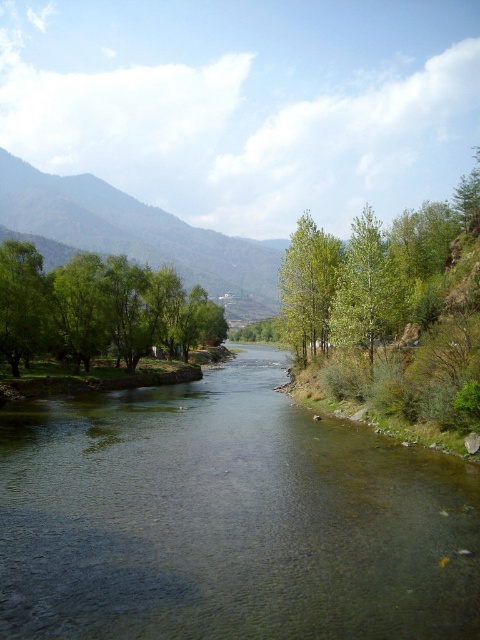
Between green leafy mountain at upper left and green leafy tree at right, which one is positioned higher?

Positioned higher is green leafy mountain at upper left.

What do you see at coordinates (136, 234) in the screenshot? I see `green leafy mountain at upper left` at bounding box center [136, 234].

Locate an element on the screen. The width and height of the screenshot is (480, 640). green leafy mountain at upper left is located at coordinates click(136, 234).

Is green leafy trees at left thinner than green leafy tree at left?

Incorrect, green leafy trees at left's width is not less than green leafy tree at left's.

Which of these two, green leafy trees at left or green leafy tree at left, stands shorter?

green leafy tree at left

Is point (128, 260) behind point (38, 307)?

Yes, it is.

At what (x,y) coordinates should I click in order to perform the action: click on green leafy trees at left. Please return your answer as a coordinate pair (x, y). The height and width of the screenshot is (640, 480). Looking at the image, I should click on (97, 308).

Which is in front, point (216, 472) or point (20, 316)?

Point (216, 472) is more forward.

Is clear water at center positioned in front of green leafy tree at left?

Yes, it is in front of green leafy tree at left.

Does point (367, 577) lie behind point (21, 262)?

No.

Where is `clear water at center`? Image resolution: width=480 pixels, height=640 pixels. clear water at center is located at coordinates (228, 518).